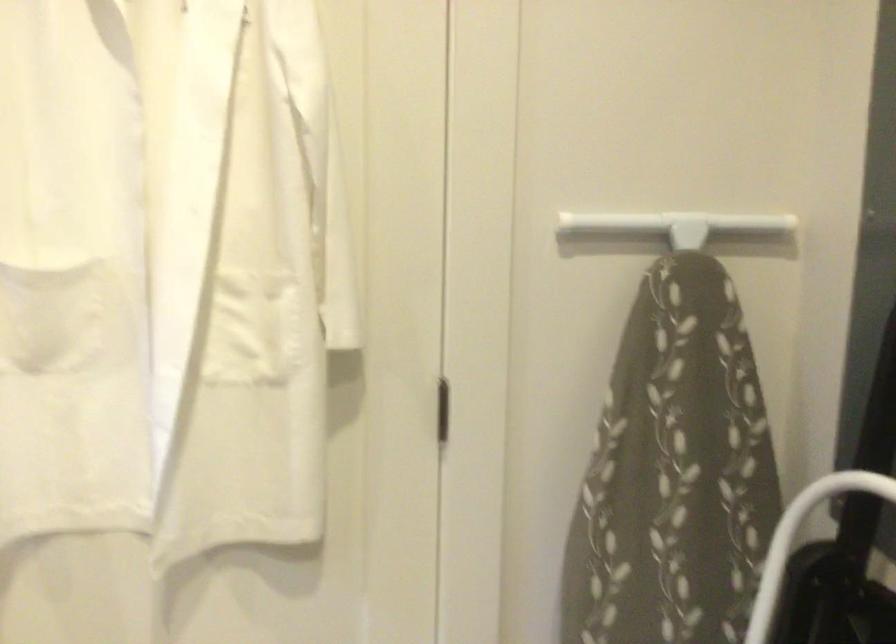
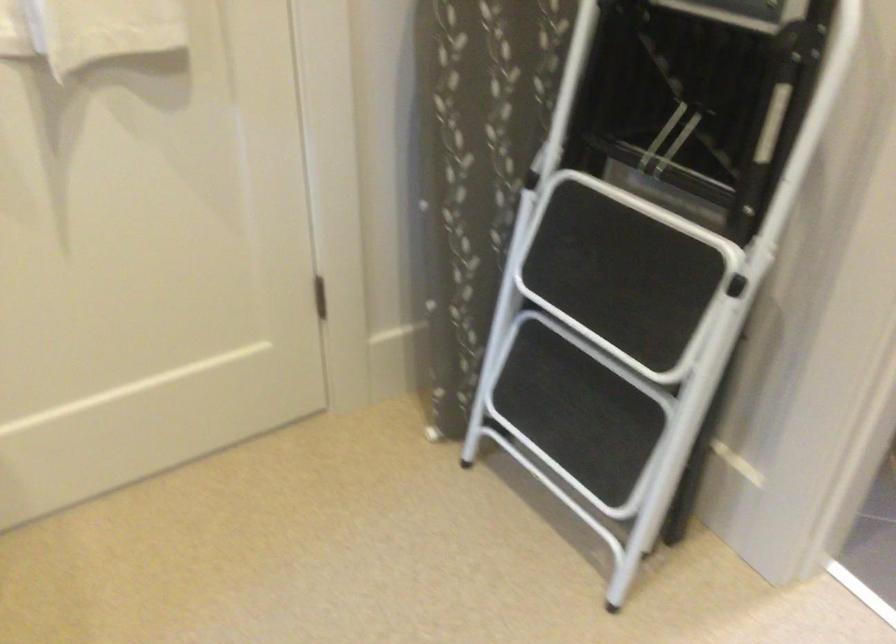
The first image is from the beginning of the video and the second image is from the end. How did the camera likely rotate when shooting the video?

The camera's rotation is toward right-down.